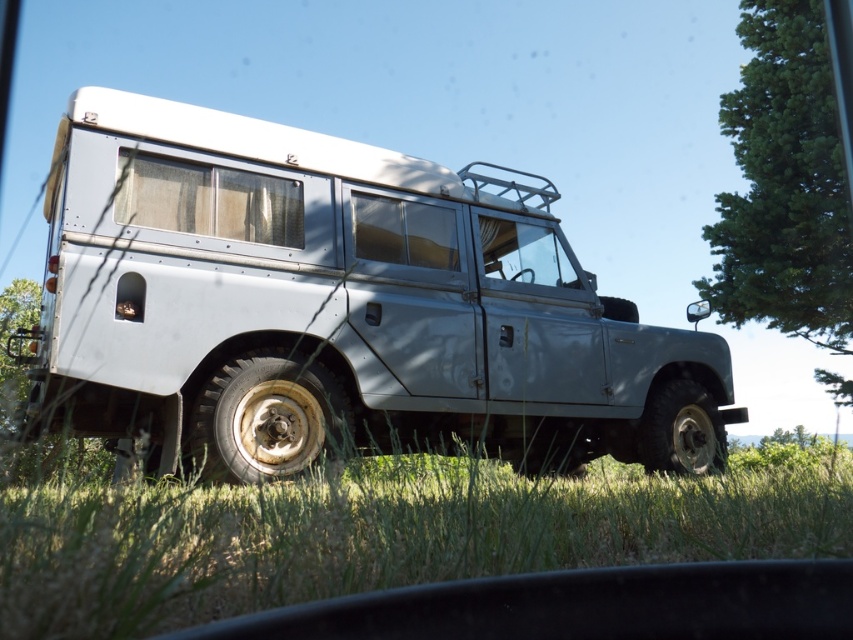
Please provide the 2D coordinates of the silver metallic suv at center in the image. The answer should be in the format of a point with two decimal places, like this example format point format example. The scene is a vintage Land Rover Defender parked outdoors in a grassy area under a clear blue sky. The vehicle has a roof rack and is painted light gray. The tires are large and rugged, and the windows have beige curtains.

The 2D coordinates of the silver metallic suv at center are point (340, 307).

You are standing in the grassy area and want to take a photo of both the silver metallic suv at center and the green leafy tree at upper right. Which object should you focus on first to ensure both are in sharp focus?

You should focus on the silver metallic suv at center first since it is closer to you than the green leafy tree at upper right. By focusing on the closer object, the tree will also be in focus due to the depth of field.